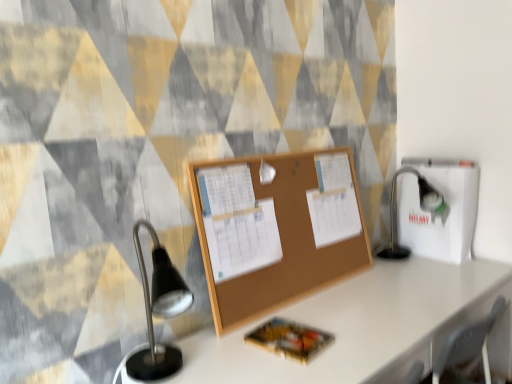
Question: Is black metal table lamp at right oriented away from white cardboard box at right?

Choices:
 (A) yes
 (B) no

Answer: (B)

Question: Can we say black metal table lamp at right lies outside white cardboard box at right?

Choices:
 (A) yes
 (B) no

Answer: (A)

Question: Is white cardboard box at right completely or partially inside black metal table lamp at right?

Choices:
 (A) no
 (B) yes

Answer: (A)

Question: Considering the relative sizes of black metal table lamp at right and white cardboard box at right in the image provided, is black metal table lamp at right bigger than white cardboard box at right?

Choices:
 (A) no
 (B) yes

Answer: (B)

Question: Is black metal table lamp at right behind white cardboard box at right?

Choices:
 (A) no
 (B) yes

Answer: (A)

Question: Do you think white cardboard box at right is within corkboard at center, or outside of it?

Choices:
 (A) inside
 (B) outside

Answer: (B)

Question: Based on their positions, is white cardboard box at right located to the left or right of corkboard at center?

Choices:
 (A) right
 (B) left

Answer: (A)

Question: Is point (432, 231) closer or farther from the camera than point (283, 190)?

Choices:
 (A) closer
 (B) farther

Answer: (B)

Question: From the image's perspective, relative to corkboard at center, is white cardboard box at right above or below?

Choices:
 (A) above
 (B) below

Answer: (A)

Question: Is corkboard at center in front of or behind black metal table lamp at right in the image?

Choices:
 (A) behind
 (B) front

Answer: (B)

Question: Considering the positions of corkboard at center and black metal table lamp at right in the image, is corkboard at center wider or thinner than black metal table lamp at right?

Choices:
 (A) thin
 (B) wide

Answer: (A)

Question: In terms of height, does corkboard at center look taller or shorter compared to black metal table lamp at right?

Choices:
 (A) tall
 (B) short

Answer: (A)

Question: In terms of size, does corkboard at center appear bigger or smaller than black metal table lamp at right?

Choices:
 (A) small
 (B) big

Answer: (A)

Question: From a real-world perspective, is black metal table lamp at right above or below corkboard at center?

Choices:
 (A) above
 (B) below

Answer: (B)

Question: Does point (433, 196) appear closer or farther from the camera than point (257, 157)?

Choices:
 (A) closer
 (B) farther

Answer: (B)